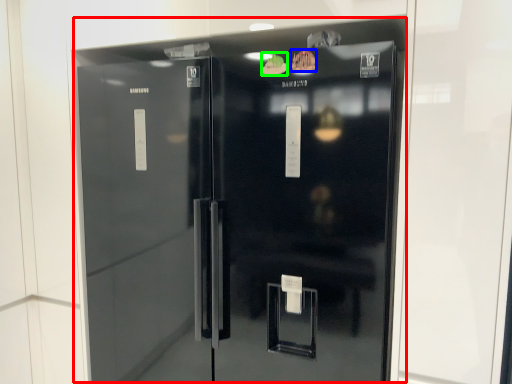
Question: Which object is the closest to the refrigerator (highlighted by a red box)? Choose among these: food (highlighted by a blue box) or food (highlighted by a green box).

Choices:
 (A) food
 (B) food

Answer: (B)